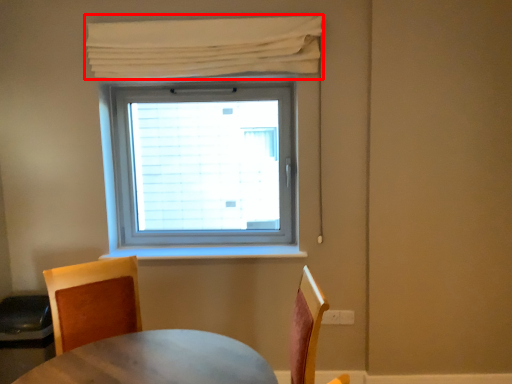
Question: From the image's perspective, what is the correct spatial relationship of curtain (annotated by the red box) in relation to chair?

Choices:
 (A) below
 (B) above

Answer: (B)